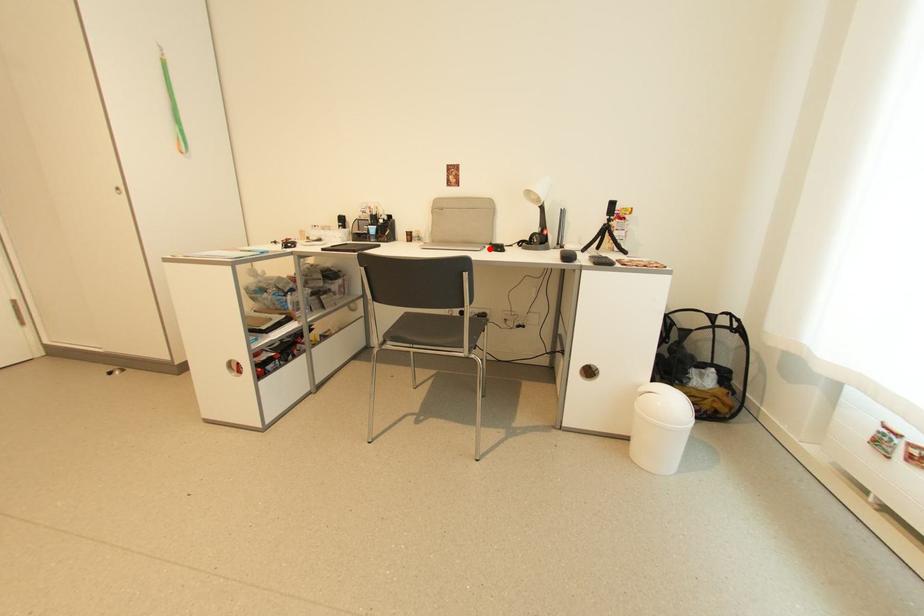
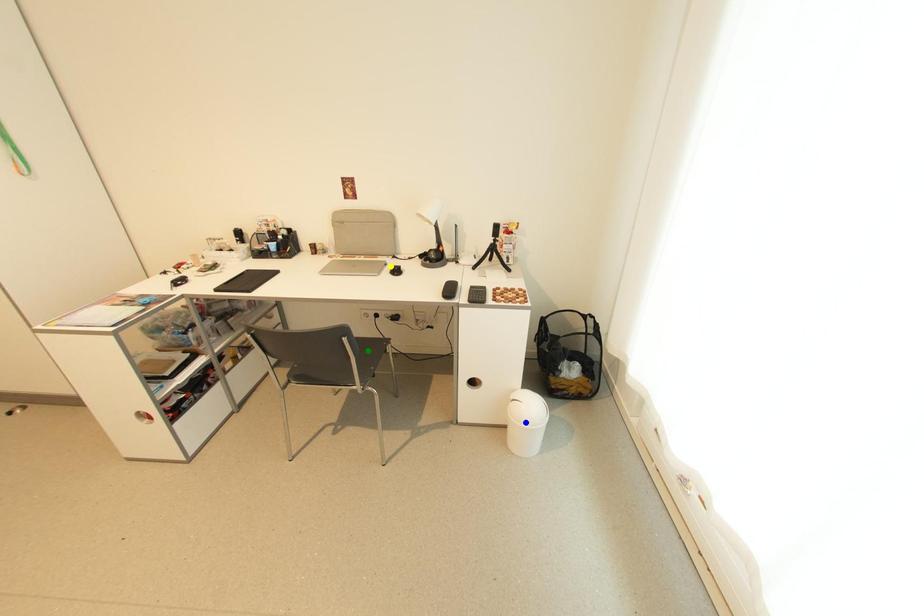
Question: I am providing you with two images of the same scene from different viewpoints. A red point is marked on the first image. You are given multiple points on the second image. Which point in image 2 is actually the same real-world point as the red point in image 1?

Choices:
 (A) yellow point
 (B) green point
 (C) blue point

Answer: (A)